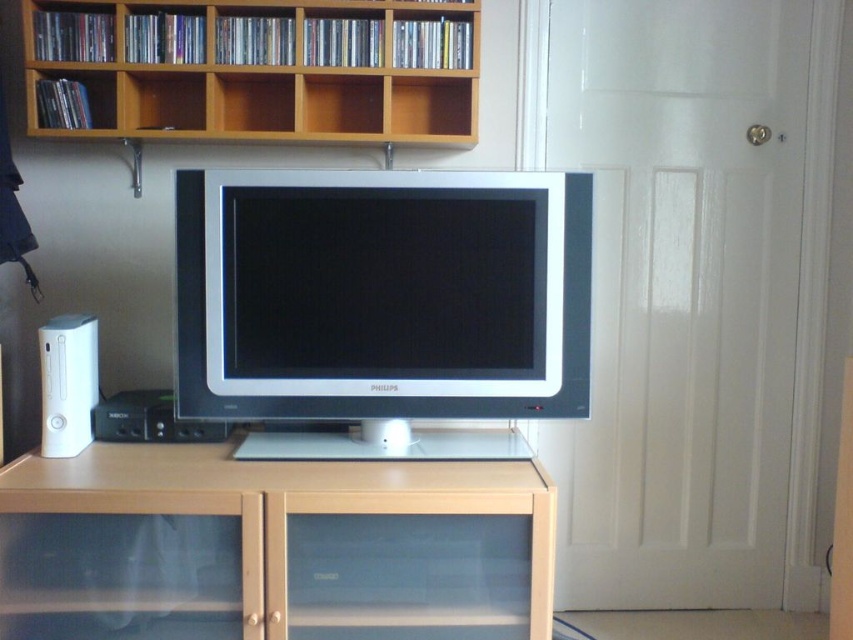
Question: Which of these objects is positioned farthest from the wooden shelves at upper center?

Choices:
 (A) satin silver monitor at center
 (B) beige wood cabinet at center

Answer: (B)

Question: Among these points, which one is nearest to the camera?

Choices:
 (A) (549, 352)
 (B) (529, 499)
 (C) (294, 29)
 (D) (61, 321)

Answer: (B)

Question: Estimate the real-world distances between objects in this image. Which object is closer to the white plastic speaker at left?

Choices:
 (A) beige wood cabinet at center
 (B) wooden shelves at upper center
 (C) satin silver monitor at center
 (D) matte wood entertainment center at center

Answer: (A)

Question: Is matte wood entertainment center at center in front of white plastic speaker at left?

Choices:
 (A) no
 (B) yes

Answer: (B)

Question: Does satin silver monitor at center have a lesser width compared to matte wood entertainment center at center?

Choices:
 (A) no
 (B) yes

Answer: (B)

Question: Does beige wood cabinet at center appear on the right side of wooden shelves at upper center?

Choices:
 (A) no
 (B) yes

Answer: (B)